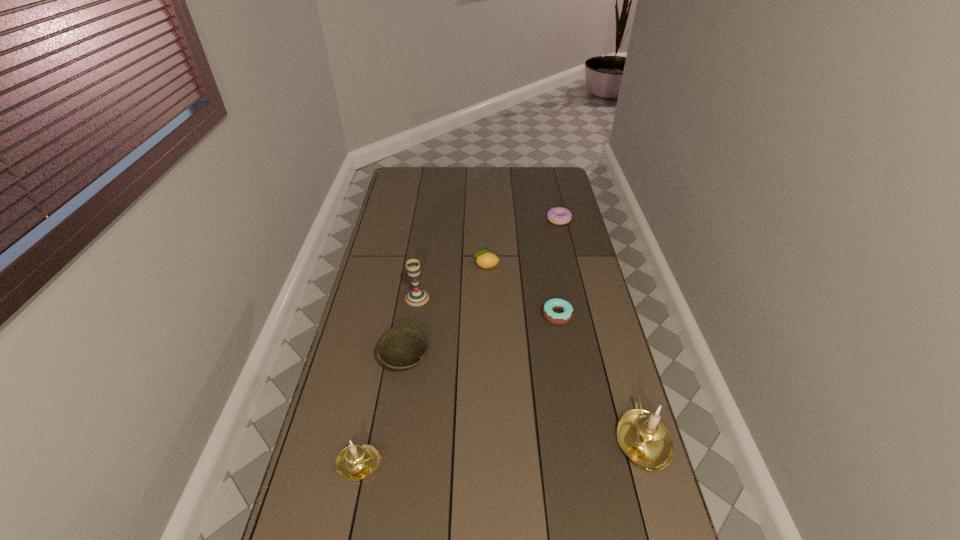
The height and width of the screenshot is (540, 960). I want to click on chalice, so click(x=417, y=297).

You are a GUI agent. You are given a task and a screenshot of the screen. Output one action in this format:
    pyautogui.click(x=<x>, y=<y>)
    Task: Click on the free spot located on the handle side of the fifth shortest object
    
    Given the screenshot: What is the action you would take?
    pyautogui.click(x=533, y=463)

Identify the location of free space located on the handle side of the right candle holder. This screenshot has width=960, height=540. (607, 316).

Image resolution: width=960 pixels, height=540 pixels. I want to click on free location located 0.150m on the handle side of the right candle holder, so click(621, 363).

Where is `vacant space located 0.310m on the handle side of the right candle holder`? This screenshot has height=540, width=960. vacant space located 0.310m on the handle side of the right candle holder is located at coordinates point(611,327).

Locate an element on the screen. The width and height of the screenshot is (960, 540). vacant space situated on the front of the farthest object is located at coordinates (574, 284).

You are a GUI agent. You are given a task and a screenshot of the screen. Output one action in this format:
    pyautogui.click(x=<x>, y=<y>)
    Task: Click on the vacant space situated 0.270m on the front of the third nearest object
    This screenshot has height=540, width=960.
    Given the screenshot: What is the action you would take?
    pyautogui.click(x=389, y=466)

This screenshot has width=960, height=540. What are the coordinates of `vacant space located 0.190m on the back of the nearer doughnut` in the screenshot? It's located at (549, 270).

Find the location of a particular element. vacant region located 0.120m with leaves positioned above the second farthest object is located at coordinates (443, 266).

I want to click on free space located 0.340m with leaves positioned above the second farthest object, so (388, 266).